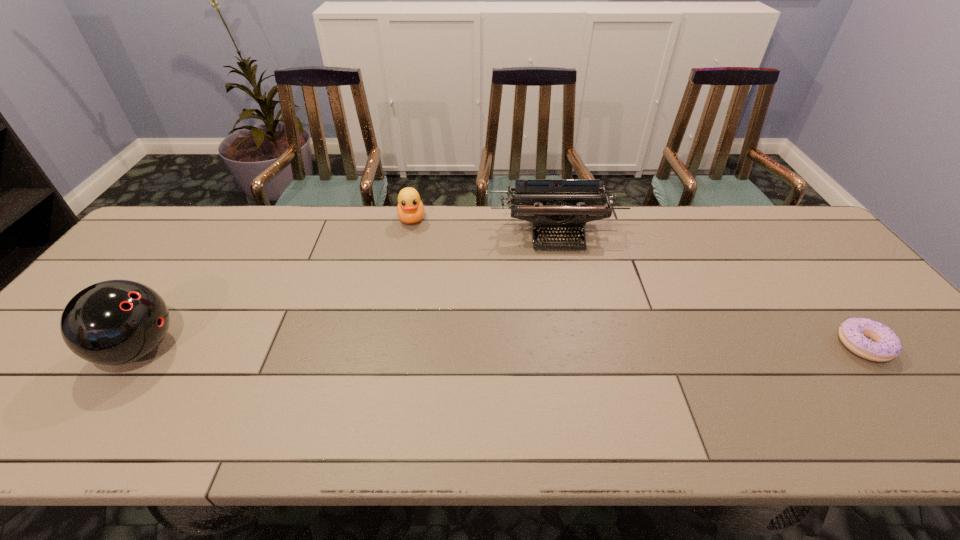
You are a GUI agent. You are given a task and a screenshot of the screen. Output one action in this format:
    pyautogui.click(x=<x>, y=<y>)
    Task: Click on the object that is positioned at the right edge
    
    Given the screenshot: What is the action you would take?
    pyautogui.click(x=869, y=339)

The image size is (960, 540). I want to click on object located in the near left corner section of the desktop, so click(114, 322).

Identify the location of free region at the far edge of the desktop. (690, 242).

Locate an element on the screen. This screenshot has width=960, height=540. free region at the near edge is located at coordinates (286, 403).

Find the location of `vacant region at the right edge of the desktop`. vacant region at the right edge of the desktop is located at coordinates (855, 303).

This screenshot has height=540, width=960. In the image, there is a desktop. Find the location of `vacant region at the far right corner`. vacant region at the far right corner is located at coordinates (792, 223).

Identify the location of free point between the second object from left to right and the leftmost object. (276, 284).

Locate an element on the screen. blank region between the third object from left to right and the leftmost object is located at coordinates (348, 291).

Where is `unoccupied area between the bowling ball and the third tallest object`? unoccupied area between the bowling ball and the third tallest object is located at coordinates (276, 284).

Locate an element on the screen. The image size is (960, 540). vacant space that's between the second tallest object and the duckling is located at coordinates (484, 226).